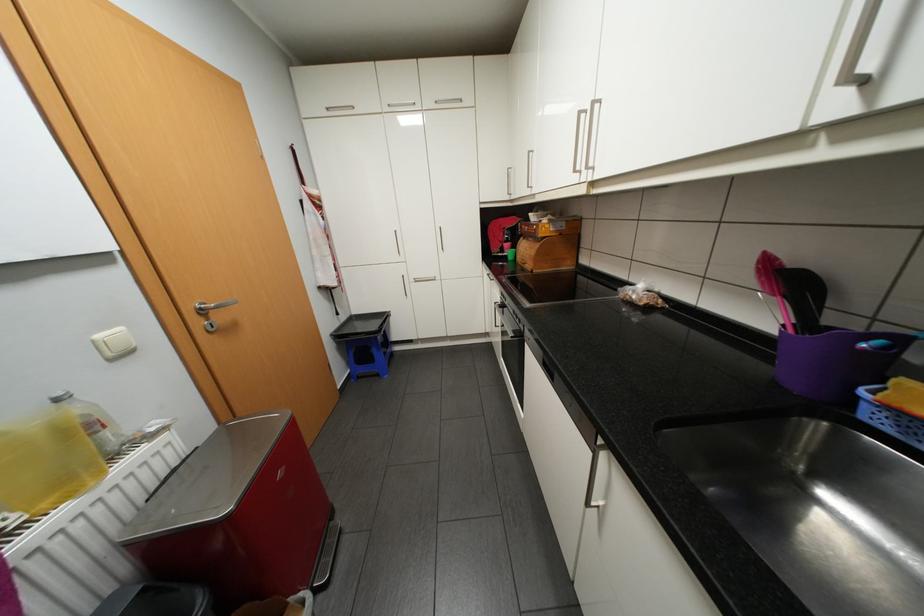
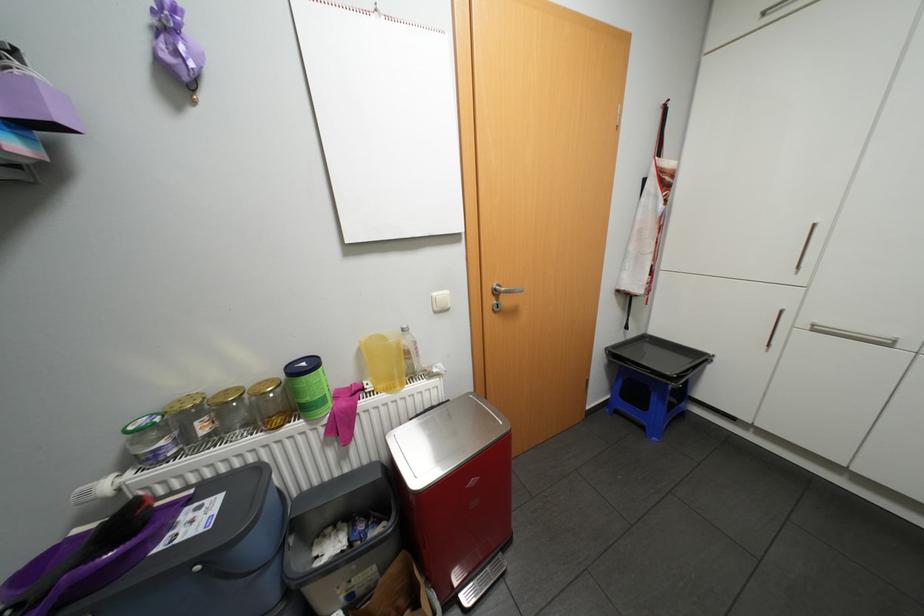
Question: The camera is either moving clockwise (left) or counter-clockwise (right) around the object. The first image is from the beginning of the video and the second image is from the end. Is the camera moving left or right when shooting the video?

Choices:
 (A) Left
 (B) Right

Answer: (B)